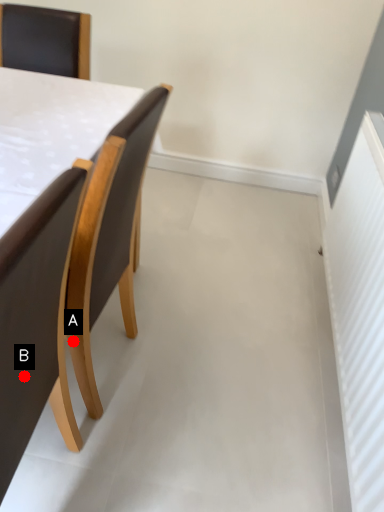
Question: Two points are circled on the image, labeled by A and B beside each circle. Which of the following is the closest to the observer?

Choices:
 (A) A is closer
 (B) B is closer

Answer: (B)